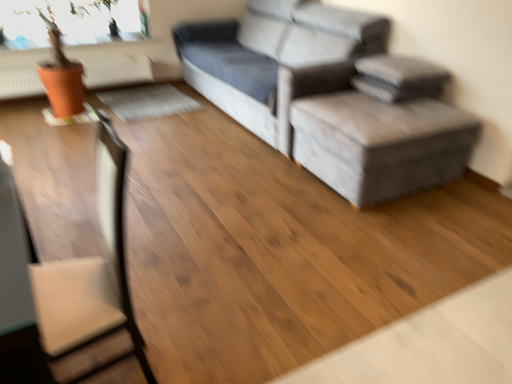
Identify the location of free space in front of gray fabric couch at upper right. Image resolution: width=512 pixels, height=384 pixels. (240, 188).